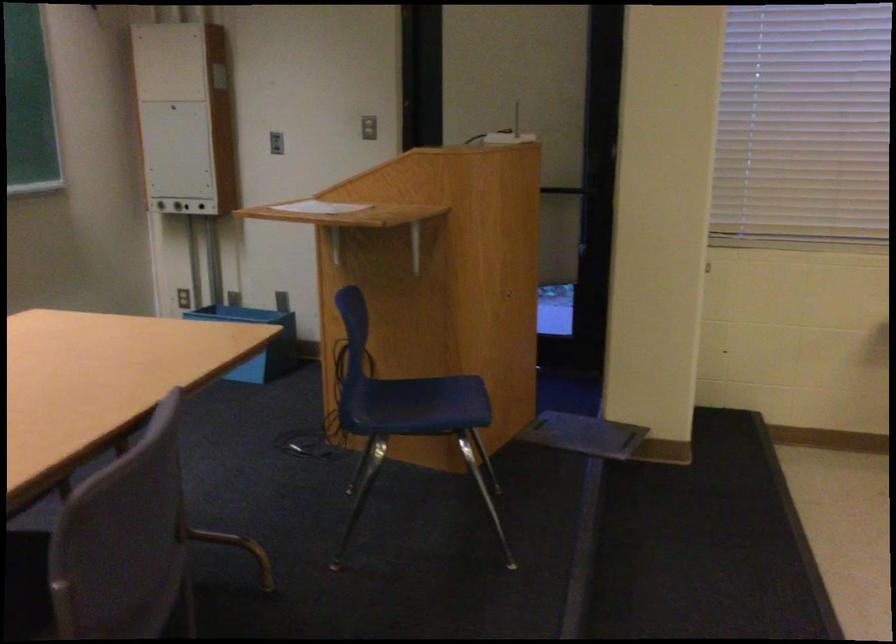
Where would you push the door push bar? Please return your answer as a coordinate pair (x, y).

(583, 189)